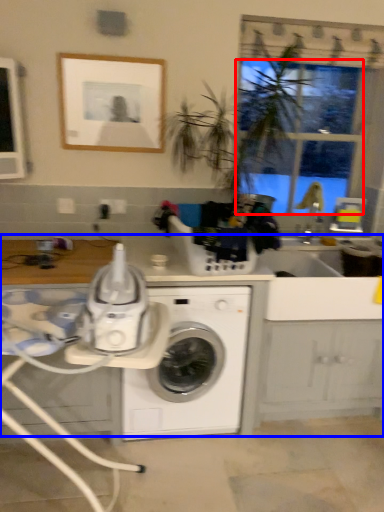
Question: Which point is closer to the camera, window screen (highlighted by a red box) or counter top (highlighted by a blue box)?

Choices:
 (A) window screen
 (B) counter top

Answer: (B)